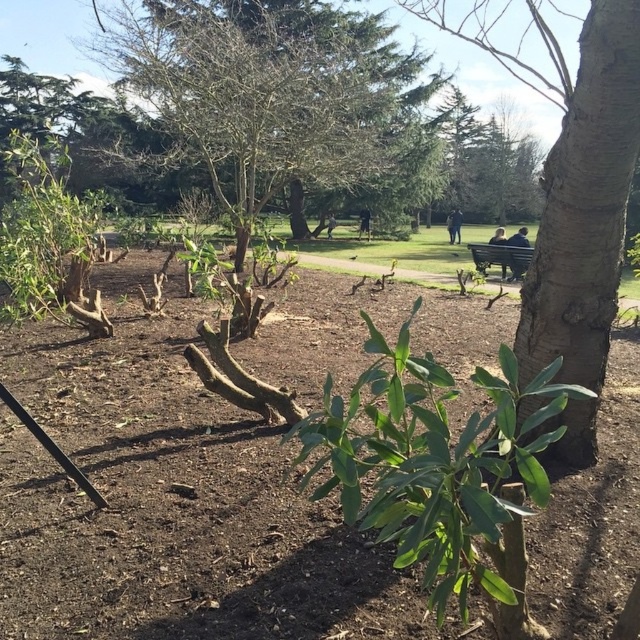
You are a gardener who wants to plant a new flower bed. You see the brown soil at center and the green leafy shrub at center. Which object is located lower in the scene?

The brown soil at center is located below the green leafy shrub at center, so it is lower in the scene.

You are standing in the park and want to take a photo of both the bare wood tree at center and the green leafy shrub at center. Which one should you focus on first to ensure both are in clear view?

You should focus on the bare wood tree at center first since it is closer to you than the green leafy shrub at center, ensuring both are in focus when using depth of field.

You are planning to install a new bench in the park. The current wooden bench at center is shorter than the green leafy shrub at center. If you want to place the new bench so that it doesn not block the view of the shrub from the path, which object should you consider its height when deciding placement?

The green leafy shrub at center is taller than the wooden bench at center. To ensure the new bench does not block the view of the shrub, you should consider the height of the green leafy shrub at center when deciding placement, as it is the taller object in the area.